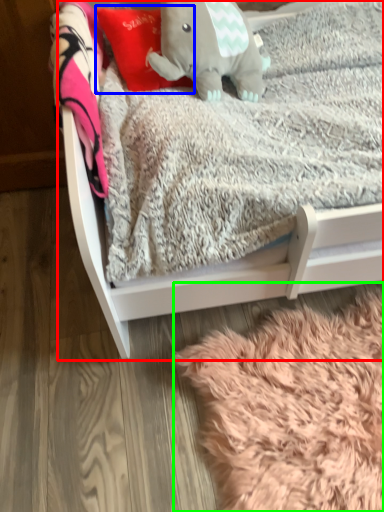
Question: Which object is positioned closest to infant bed (highlighted by a red box)? Select from throw pillow (highlighted by a blue box) and blanket (highlighted by a green box).

Choices:
 (A) throw pillow
 (B) blanket

Answer: (B)